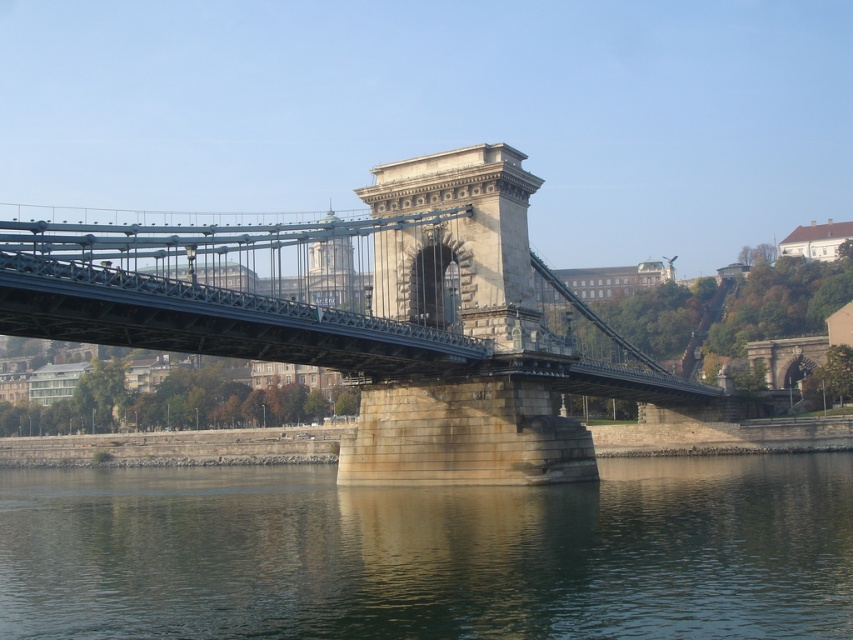
Question: Can you confirm if greenish water at lower center is wider than metallic stone bridge at center?

Choices:
 (A) yes
 (B) no

Answer: (A)

Question: Which object appears farthest from the camera in this image?

Choices:
 (A) greenish water at lower center
 (B) metallic stone bridge at center

Answer: (B)

Question: Does greenish water at lower center come in front of metallic stone bridge at center?

Choices:
 (A) yes
 (B) no

Answer: (A)

Question: Is greenish water at lower center to the left of metallic stone bridge at center from the viewer's perspective?

Choices:
 (A) no
 (B) yes

Answer: (B)